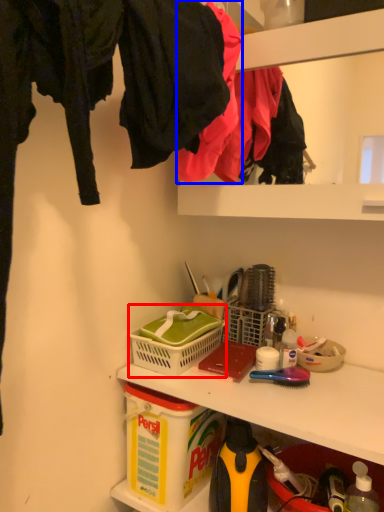
Question: Which object is further to the camera taking this photo, picnic basket (highlighted by a red box) or clothing (highlighted by a blue box)?

Choices:
 (A) picnic basket
 (B) clothing

Answer: (A)